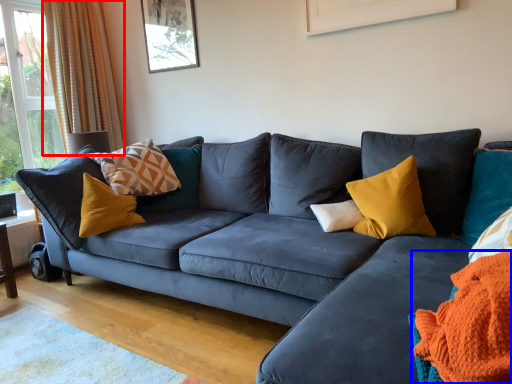
Question: Which object is closer to the camera taking this photo, curtain (highlighted by a red box) or blanket (highlighted by a blue box)?

Choices:
 (A) curtain
 (B) blanket

Answer: (B)